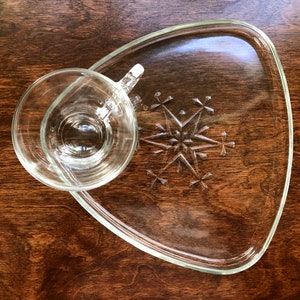
Identify the location of dish. (244, 153).